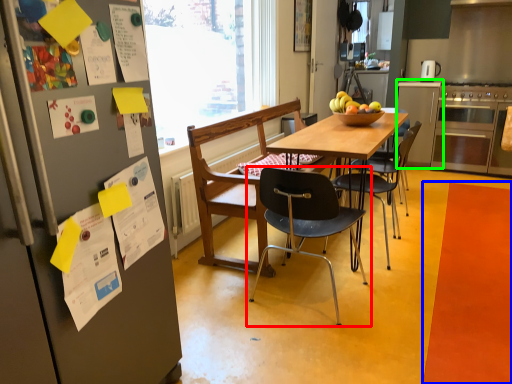
Question: Estimate the real-world distances between objects in this image. Which object is farther from chair (highlighted by a red box), mat (highlighted by a blue box) or cabinetry (highlighted by a green box)?

Choices:
 (A) mat
 (B) cabinetry

Answer: (B)